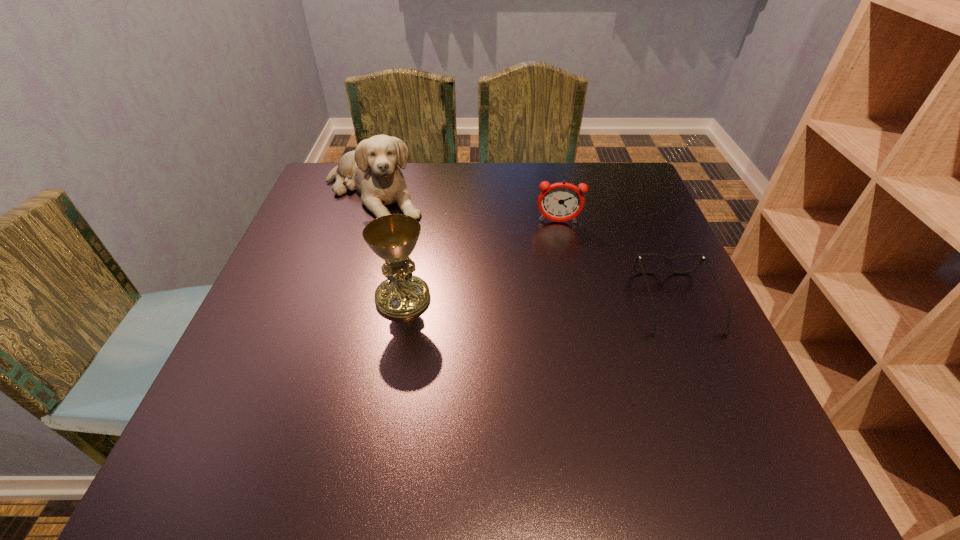
This screenshot has width=960, height=540. Identify the location of chalice. (393, 238).

Locate an element on the screen. This screenshot has height=540, width=960. the rightmost object is located at coordinates (669, 260).

Find the location of a particular element. This screenshot has width=960, height=540. spectacles is located at coordinates (669, 260).

Find the location of a particular element. The height and width of the screenshot is (540, 960). the third object from left to right is located at coordinates (560, 202).

Image resolution: width=960 pixels, height=540 pixels. Identify the location of alarm clock. (560, 202).

The image size is (960, 540). I want to click on puppy, so click(373, 168).

What are the coordinates of `vacant space situated 0.100m on the right of the chalice` in the screenshot? It's located at (479, 298).

Image resolution: width=960 pixels, height=540 pixels. Find the location of `blank space located with the lenses facing outward on the spectacles`. blank space located with the lenses facing outward on the spectacles is located at coordinates (710, 382).

Identify the location of vacant region located 0.390m on the front-facing side of the second shortest object. (564, 355).

This screenshot has width=960, height=540. In order to click on vacant region located 0.090m on the front-facing side of the second shortest object in this screenshot , I will do `click(558, 250)`.